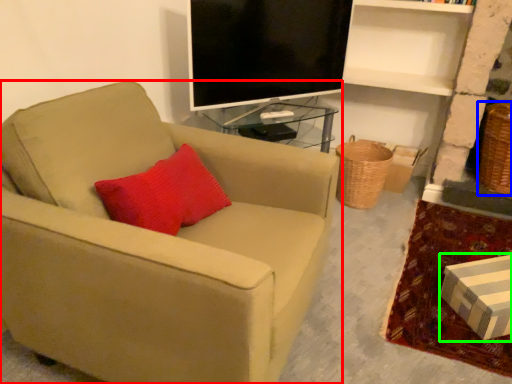
Question: Which object is the closest to the chair (highlighted by a red box)? Choose among these: basket (highlighted by a blue box) or box (highlighted by a green box).

Choices:
 (A) basket
 (B) box

Answer: (B)